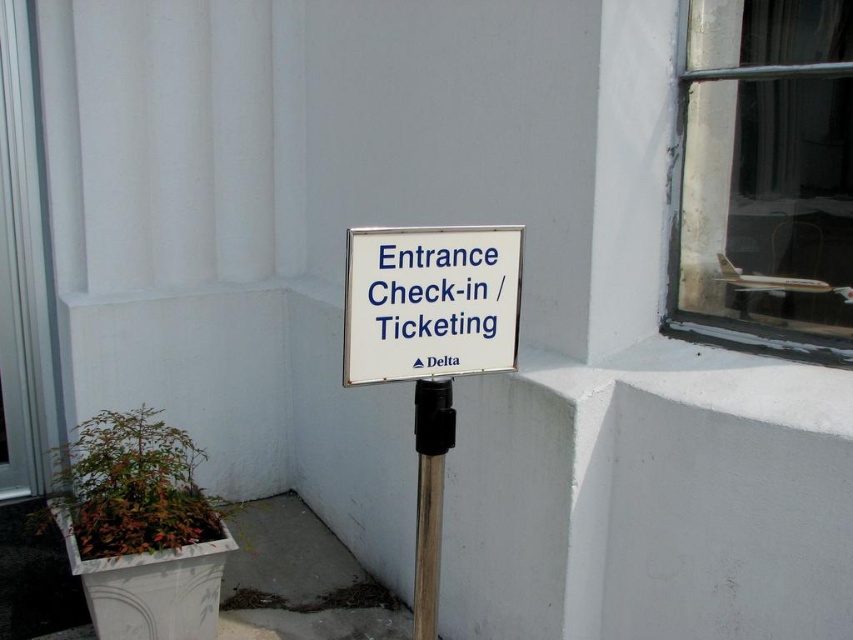
Can you confirm if white plastic sign at center is positioned to the right of metallic pole at center?

Indeed, white plastic sign at center is positioned on the right side of metallic pole at center.

Locate an element on the screen. This screenshot has height=640, width=853. white plastic sign at center is located at coordinates (431, 301).

Between point (412, 332) and point (450, 417), which one is positioned in front?

Point (412, 332)

What are the coordinates of `white plastic sign at center` in the screenshot? It's located at (431, 301).